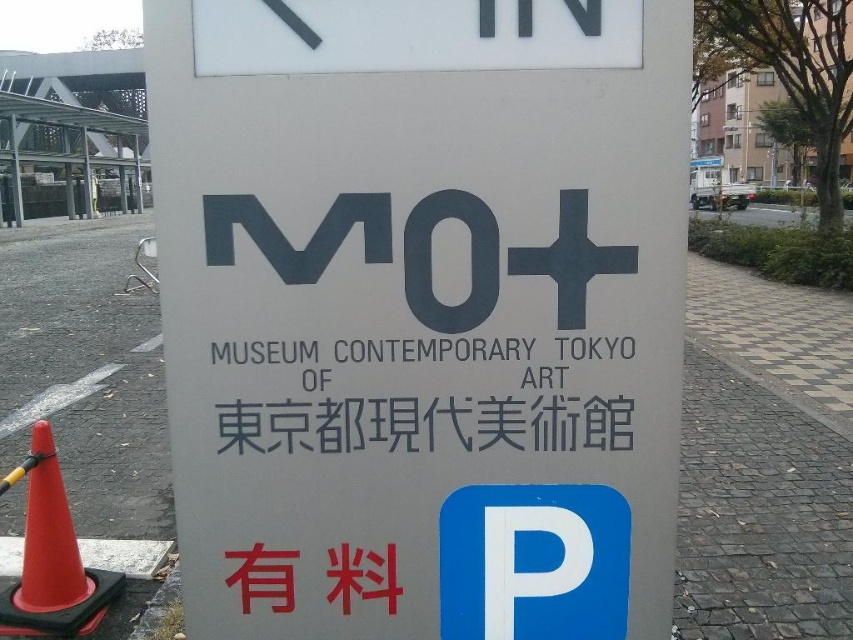
Image resolution: width=853 pixels, height=640 pixels. What do you see at coordinates (422, 312) in the screenshot?
I see `satin gray sign at center` at bounding box center [422, 312].

Who is more distant from viewer, (306, 497) or (4, 484)?

The point (4, 484) is behind.

Where is `satin gray sign at center`? Image resolution: width=853 pixels, height=640 pixels. satin gray sign at center is located at coordinates (422, 312).

Who is more distant from viewer, (419, 176) or (334, 404)?

The point (334, 404) is behind.

Who is more forward, (350, 401) or (311, 372)?

Point (311, 372)

Find the location of a particular element. The height and width of the screenshot is (640, 853). satin gray sign at center is located at coordinates (422, 312).

Measure the distance between blackmaterial/texturetext at center and camera.

blackmaterial/texturetext at center is 3.94 feet from camera.

Between blackmaterial/texturetext at center and orange plastic traffic cone at lower left, which one appears on the left side from the viewer's perspective?

orange plastic traffic cone at lower left is more to the left.

Is point (606, 449) positioned before point (45, 593)?

Yes, it is.

Where is `blackmaterial/texturetext at center`? Image resolution: width=853 pixels, height=640 pixels. blackmaterial/texturetext at center is located at coordinates (426, 422).